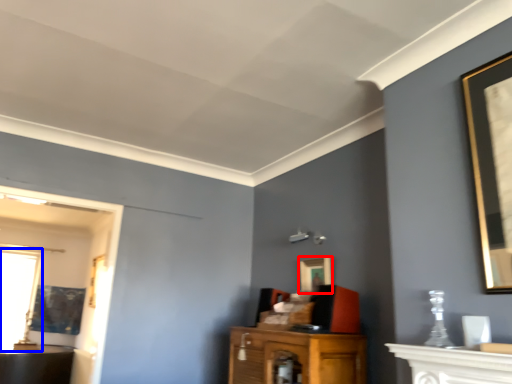
Question: Which object is further to the camera taking this photo, picture frame (highlighted by a red box) or window (highlighted by a blue box)?

Choices:
 (A) picture frame
 (B) window

Answer: (B)